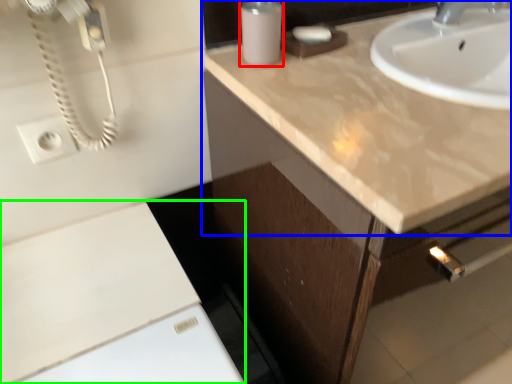
Question: Considering the real-world distances, which object is farthest from soap dispenser (highlighted by a red box)? countertop (highlighted by a blue box) or cabinetry (highlighted by a green box)?

Choices:
 (A) countertop
 (B) cabinetry

Answer: (B)